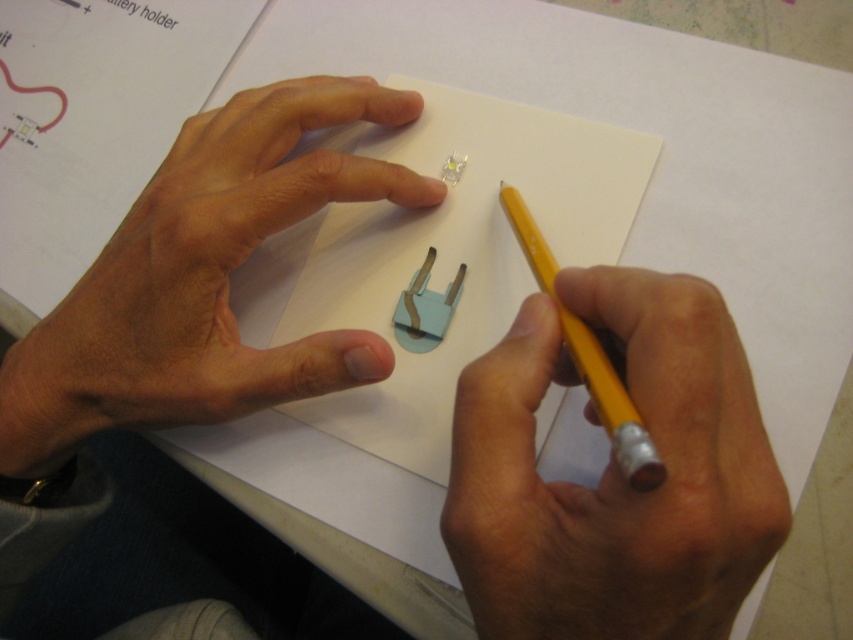
You are trying to determine which object is longer between the yellow wood pencil at center and the dry skin at upper left. Based on the scene, which one is longer?

The dry skin at upper left is longer than the yellow wood pencil at center.

What are the coordinates of the yellow wood pencil at center in the image?

The yellow wood pencil at center is located at coordinates point (614,474).